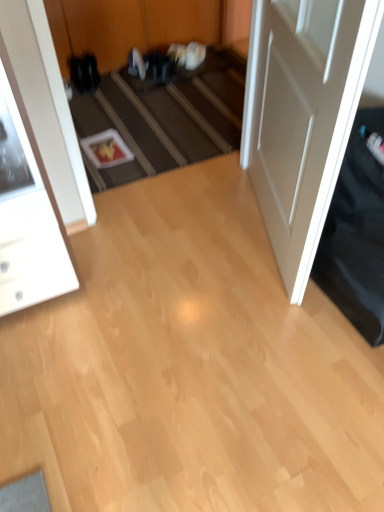
At what (x,y) coordinates should I click in order to perform the action: click on white glossy cabinet at left. Please return your answer as a coordinate pair (x, y). The width and height of the screenshot is (384, 512). Looking at the image, I should click on (27, 213).

Where is `carpeted stairs at center`? The image size is (384, 512). carpeted stairs at center is located at coordinates (165, 118).

The width and height of the screenshot is (384, 512). What are the coordinates of `white glossy cabinet at left` in the screenshot? It's located at (27, 213).

From a real-world perspective, is white glossy cabinet at left below white matte door at right?

Yes.

From the picture: Can you confirm if white glossy cabinet at left is shorter than white matte door at right?

Indeed, white glossy cabinet at left has a lesser height compared to white matte door at right.

Are white glossy cabinet at left and white matte door at right far apart?

No, white glossy cabinet at left is not far from white matte door at right.

Consider the image. From a real-world perspective, between white matte door at right and white glossy cabinet at left, who is vertically lower?

white glossy cabinet at left.

From the image's perspective, which one is positioned lower, white matte door at right or white glossy cabinet at left?

white glossy cabinet at left is shown below in the image.

Is white matte door at right at the left side of white glossy cabinet at left?

In fact, white matte door at right is to the right of white glossy cabinet at left.

Is white matte door at right wider than carpeted stairs at center?

Correct, the width of white matte door at right exceeds that of carpeted stairs at center.

Is white matte door at right surrounding carpeted stairs at center?

No, carpeted stairs at center is not a part of white matte door at right.

Considering their positions, is white matte door at right located in front of or behind carpeted stairs at center?

Visually, white matte door at right is located in front of carpeted stairs at center.

Locate an element on the screen. The image size is (384, 512). stair below the white matte door at right (from a real-world perspective) is located at coordinates (165, 118).

Could you tell me if white glossy cabinet at left is turned towards carpeted stairs at center?

No, white glossy cabinet at left is not facing towards carpeted stairs at center.

Can you confirm if white glossy cabinet at left is shorter than carpeted stairs at center?

Incorrect, the height of white glossy cabinet at left does not fall short of that of carpeted stairs at center.

Consider the image. Is carpeted stairs at center surrounded by white glossy cabinet at left?

No, white glossy cabinet at left does not contain carpeted stairs at center.

Between point (7, 192) and point (122, 130), which one is positioned behind?

Positioned behind is point (122, 130).

In the scene shown: Is carpeted stairs at center positioned beyond the bounds of white matte door at right?

Yes, carpeted stairs at center is located beyond the bounds of white matte door at right.

Does carpeted stairs at center have a greater height compared to white matte door at right?

No.

Between carpeted stairs at center and white matte door at right, which one has smaller width?

Thinner between the two is carpeted stairs at center.

Which is in front, point (166, 89) or point (296, 245)?

Positioned in front is point (296, 245).

Does carpeted stairs at center appear on the left side of white glossy cabinet at left?

Incorrect, carpeted stairs at center is not on the left side of white glossy cabinet at left.

How many degrees apart are the facing directions of carpeted stairs at center and white glossy cabinet at left?

1.56 degrees.

Could you tell me if carpeted stairs at center is facing white glossy cabinet at left?

No, carpeted stairs at center does not turn towards white glossy cabinet at left.

Does carpeted stairs at center come behind white glossy cabinet at left?

That is True.

Where is `door on the right of white glossy cabinet at left`? The image size is (384, 512). door on the right of white glossy cabinet at left is located at coordinates (x=301, y=116).

Identify the location of door above the white glossy cabinet at left (from the image's perspective). This screenshot has width=384, height=512. (301, 116).

When comparing their distances from white glossy cabinet at left, does carpeted stairs at center or white matte door at right seem closer?

white matte door at right lies closer to white glossy cabinet at left than the other object.

Estimate the real-world distances between objects in this image. Which object is closer to white matte door at right, white glossy cabinet at left or carpeted stairs at center?

The object closer to white matte door at right is carpeted stairs at center.

When comparing their distances from carpeted stairs at center, does white glossy cabinet at left or white matte door at right seem further?

Based on the image, white glossy cabinet at left appears to be further to carpeted stairs at center.

Consider the image. Based on their spatial positions, is white matte door at right or carpeted stairs at center further from white glossy cabinet at left?

Based on the image, carpeted stairs at center appears to be further to white glossy cabinet at left.

Looking at the image, which one is located closer to white matte door at right, carpeted stairs at center or white glossy cabinet at left?

carpeted stairs at center is closer to white matte door at right.

Looking at the image, which one is located closer to carpeted stairs at center, white matte door at right or white glossy cabinet at left?

white matte door at right lies closer to carpeted stairs at center than the other object.

Locate an element on the screen. stair located between white glossy cabinet at left and white matte door at right in the left-right direction is located at coordinates (165, 118).